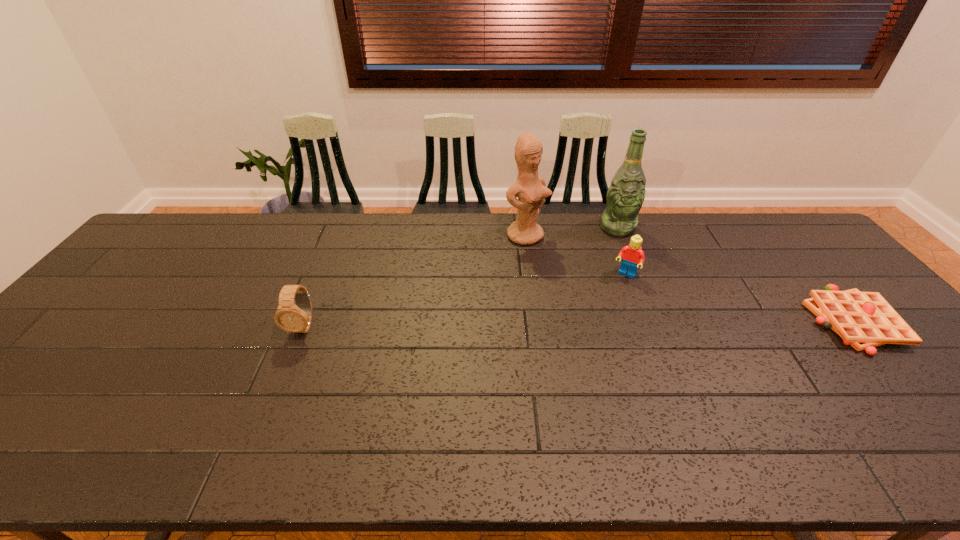
Locate an element on the screen. vacant space located 0.130m on the face of the third farthest object is located at coordinates (607, 308).

Identify the location of vacant space located 0.150m on the front-facing side of the figurine. (570, 271).

At what (x,y) coordinates should I click in order to perform the action: click on vacant space located 0.080m on the front-facing side of the figurine. Please return your answer as a coordinate pair (x, y). This screenshot has width=960, height=540. Looking at the image, I should click on (555, 259).

Locate an element on the screen. free region located on the front-facing side of the figurine is located at coordinates (626, 314).

Image resolution: width=960 pixels, height=540 pixels. Find the location of `vacant space positioned on the surface of the beer bottle`. vacant space positioned on the surface of the beer bottle is located at coordinates (633, 326).

You are a GUI agent. You are given a task and a screenshot of the screen. Output one action in this format:
    pyautogui.click(x=<x>, y=<y>)
    Task: Click on the free space located 0.160m on the surface of the beer bottle
    
    Given the screenshot: What is the action you would take?
    pyautogui.click(x=624, y=269)

This screenshot has height=540, width=960. In order to click on free region located 0.170m on the surface of the beer bottle in this screenshot , I will do `click(624, 271)`.

Identify the location of figurine present at the far edge. This screenshot has height=540, width=960. (531, 190).

What are the coordinates of `beer bottle situated at the far edge` in the screenshot? It's located at (625, 196).

Where is `object that is at the right edge`? object that is at the right edge is located at coordinates (864, 320).